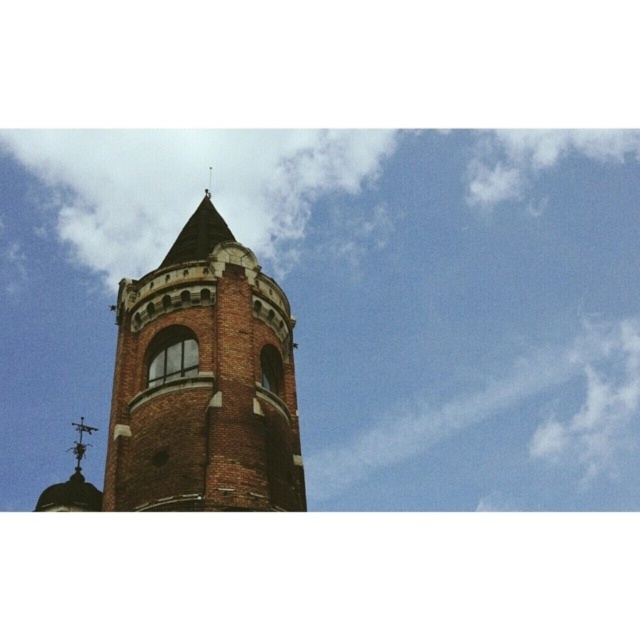
You are standing at the base of the brick tower at center and looking upward. Which direction should you look to see the white fluffy cloud at upper center?

The white fluffy cloud at upper center is positioned on the right side of the brick tower at center, so you should look to the right to see it.

You are an architect examining the brick tower at center and the polished metal spire at upper center from below. Which structure appears wider from your vantage point?

The brick tower at center appears wider than the polished metal spire at upper center from below because the brick tower at center has a lesser width compared to the polished metal spire at upper center.

You are standing in a field looking up at the brick tower at center. If you want to take a photo of the tower with the weather vane clearly visible at the very top, where should you position yourself relative to the tower?

The brick tower at center is located at point (204, 381), so you should position yourself slightly to the left of the tower to ensure the weather vane at the top left corner is visible in your photo.